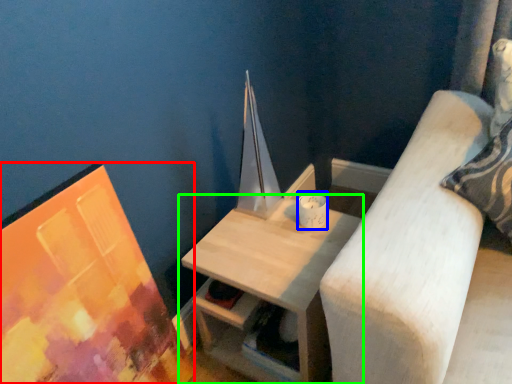
Question: Which is farther away from picture frame (highlighted by a red box)? candle holder (highlighted by a blue box) or table (highlighted by a green box)?

Choices:
 (A) candle holder
 (B) table

Answer: (A)